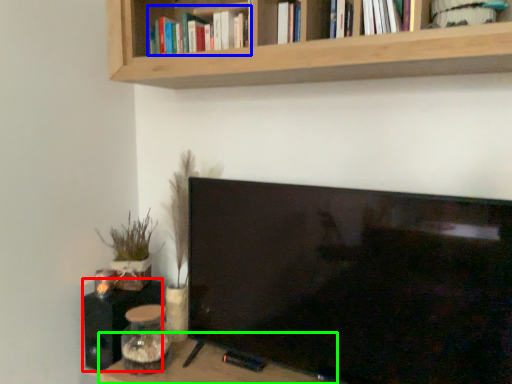
Question: Based on their relative distances, which object is nearer to speaker (highlighted by a red box)? Choose from book (highlighted by a blue box) and table (highlighted by a green box).

Choices:
 (A) book
 (B) table

Answer: (B)